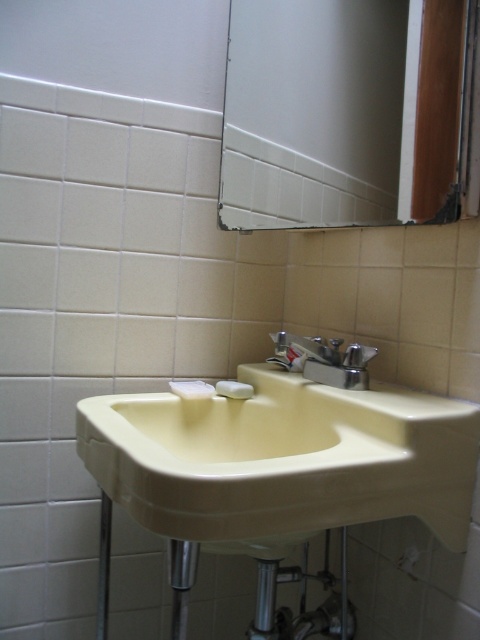
You are a home decorator planning to install a new mirror and faucet in the bathroom. You have a space that can only accommodate items where the mirror is wider than the faucet. Based on the image, will the current matte glass mirror at upper center and silver metallic faucet at upper center fit your requirements?

Yes, the matte glass mirror at upper center is wider than the silver metallic faucet at upper center, so they will fit the requirement.

You are a guest in this bathroom and want to wash your hands. The white matte soap at sink is your target. Based on the scene, where should you look relative to the beige porcelain sink at center to find the soap?

The white matte soap at sink is located to the left of the beige porcelain sink at center.

You are a professional photographer standing at the sink in the bathroom. You want to take a photo of the matte glass mirror at upper center without any distortion. What is the minimum distance you need to maintain from the mirror to avoid distortion?

The matte glass mirror at upper center is 31.72 inches from camera. To avoid distortion, you should maintain at least 31.72 inches distance from the mirror.